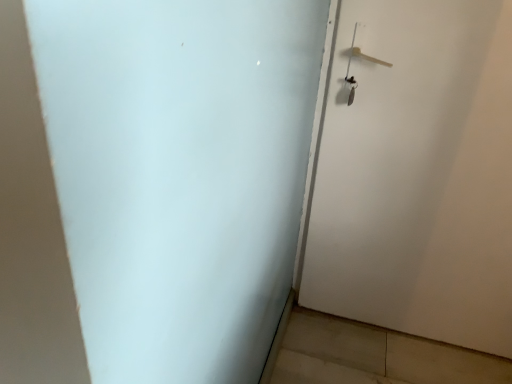
This screenshot has width=512, height=384. Describe the element at coordinates (418, 174) in the screenshot. I see `white matte door at right` at that location.

Identify the location of white matte door at right. (418, 174).

The image size is (512, 384). Find the location of `white matte door at right`. white matte door at right is located at coordinates (418, 174).